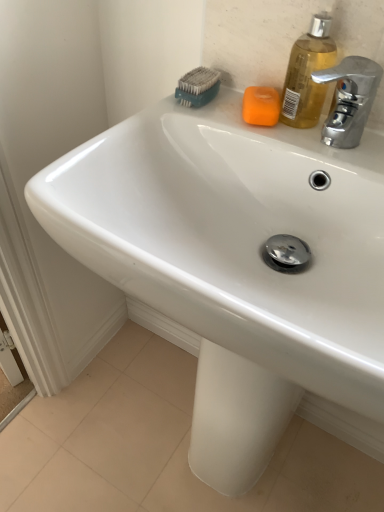
Question: From a real-world perspective, is teal plastic brush at upper center physically below orange matte soap at upper center?

Choices:
 (A) yes
 (B) no

Answer: (B)

Question: Is teal plastic brush at upper center to the right of orange matte soap at upper center from the viewer's perspective?

Choices:
 (A) no
 (B) yes

Answer: (A)

Question: Is teal plastic brush at upper center thinner than orange matte soap at upper center?

Choices:
 (A) no
 (B) yes

Answer: (B)

Question: Is teal plastic brush at upper center completely or partially outside of orange matte soap at upper center?

Choices:
 (A) no
 (B) yes

Answer: (B)

Question: From a real-world perspective, is teal plastic brush at upper center physically above orange matte soap at upper center?

Choices:
 (A) yes
 (B) no

Answer: (A)

Question: Considering the positions of translucent yellow liquid at upper right and orange matte soap at upper center in the image, is translucent yellow liquid at upper right bigger or smaller than orange matte soap at upper center?

Choices:
 (A) small
 (B) big

Answer: (B)

Question: Considering the positions of translucent yellow liquid at upper right and orange matte soap at upper center in the image, is translucent yellow liquid at upper right taller or shorter than orange matte soap at upper center?

Choices:
 (A) short
 (B) tall

Answer: (B)

Question: Looking at their shapes, would you say translucent yellow liquid at upper right is wider or thinner than orange matte soap at upper center?

Choices:
 (A) wide
 (B) thin

Answer: (B)

Question: Would you say translucent yellow liquid at upper right is to the left or to the right of orange matte soap at upper center in the picture?

Choices:
 (A) right
 (B) left

Answer: (A)

Question: Would you say teal plastic brush at upper center is to the left or to the right of orange matte soap at upper center in the picture?

Choices:
 (A) left
 (B) right

Answer: (A)

Question: Which is correct: teal plastic brush at upper center is inside orange matte soap at upper center, or outside of it?

Choices:
 (A) outside
 (B) inside

Answer: (A)

Question: From the image's perspective, relative to orange matte soap at upper center, is teal plastic brush at upper center above or below?

Choices:
 (A) above
 (B) below

Answer: (A)

Question: Considering their positions, is teal plastic brush at upper center located in front of or behind orange matte soap at upper center?

Choices:
 (A) front
 (B) behind

Answer: (B)

Question: Looking at their shapes, would you say translucent yellow liquid at upper right is wider or thinner than teal plastic brush at upper center?

Choices:
 (A) thin
 (B) wide

Answer: (A)

Question: From a real-world perspective, is translucent yellow liquid at upper right positioned above or below teal plastic brush at upper center?

Choices:
 (A) below
 (B) above

Answer: (B)